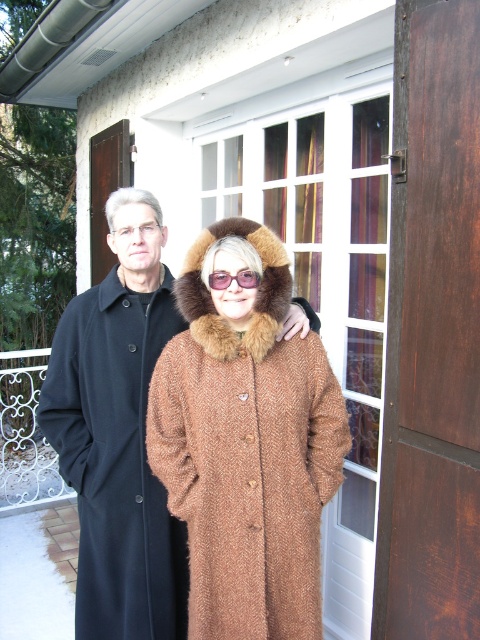
You are a delivery person who needs to hand over a package to the recipient. You see the black wool coat at left and the pink plastic goggles at center. Which object is closer to the left side of the image?

The black wool coat at left is closer to the left side of the image because it is positioned to the left of the pink plastic goggles at center.

You are standing at point (216, 278) and want to walk to point (177, 312). Based on the scene, is the destination point behind or in front of your current position?

The destination point (177, 312) is behind your current position at (216, 278) according to the spatial relationship provided.

You are a tailor measuring items for alterations. You have a measuring tape that can only measure up to 30 cm. You need to determine which item, the black wool coat at left or the pink plastic goggles at center, is wider. Can you do this without exceeding your measuring tape limit?

The black wool coat at left is wider than the pink plastic goggles at center, so you can measure the pink plastic goggles at center first with your 30 cm tape. If it fits within 30 cm, then the black wool coat at left must be wider since its width surpasses the goggles.